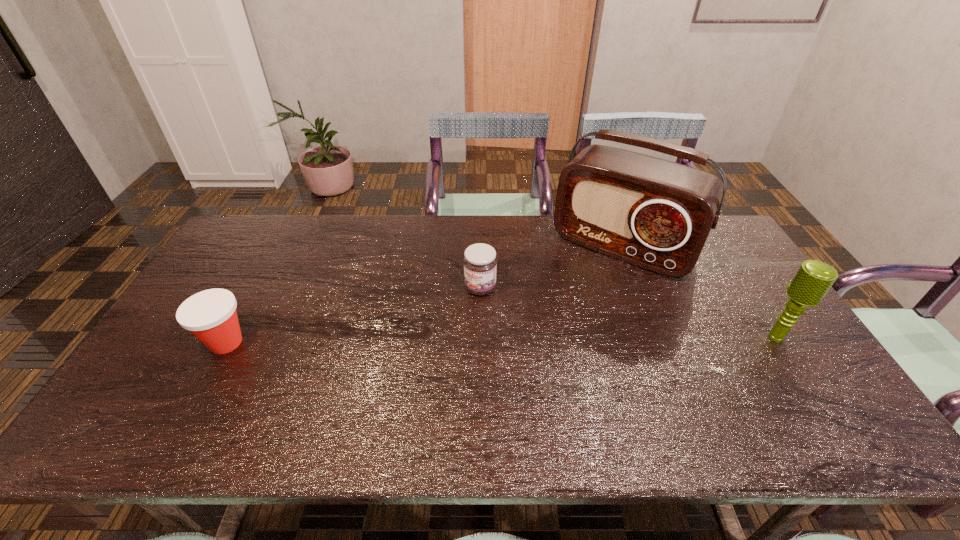
Find the location of a particular element. free space on the desktop that is between the Dixie cup and the rightmost object and is positioned on the front panel of the third object from left to right is located at coordinates (564, 339).

Find the location of a particular element. free space on the desktop that is between the Dixie cup and the second tallest object and is positioned on the front label of the second object from left to right is located at coordinates (447, 340).